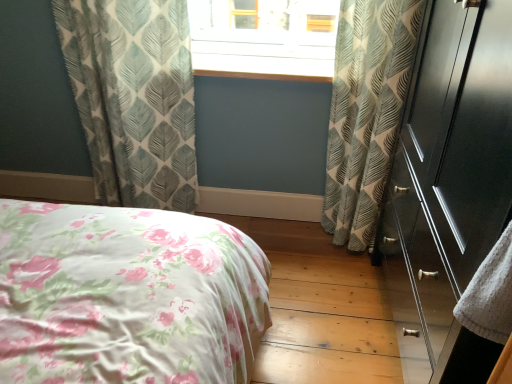
How much space does light blue textured curtains at upper left, acting as the 1th curtain starting from the left, occupy vertically?

The height of light blue textured curtains at upper left, acting as the 1th curtain starting from the left, is 3.42 feet.

Describe the element at coordinates (263, 61) in the screenshot. This screenshot has width=512, height=384. I see `wooden at center` at that location.

Identify the location of glossy dark wood dresser at right. (450, 184).

Considering the positions of points (366, 121) and (506, 43), is point (366, 121) closer to camera compared to point (506, 43)?

No.

Is leaf-patterned fabric curtain at right, the 2th curtain from the left, looking in the opposite direction of glossy dark wood dresser at right?

No.

Considering the sizes of objects leaf-patterned fabric curtain at right, positioned as the 1th curtain in right-to-left order, and glossy dark wood dresser at right in the image provided, who is thinner, leaf-patterned fabric curtain at right, positioned as the 1th curtain in right-to-left order, or glossy dark wood dresser at right?

leaf-patterned fabric curtain at right, positioned as the 1th curtain in right-to-left order.

Consider the image. How different are the orientations of light blue textured curtains at upper left, acting as the 1th curtain starting from the left, and wooden at center in degrees?

There is a 3.75-degree angle between the facing directions of light blue textured curtains at upper left, acting as the 1th curtain starting from the left, and wooden at center.

Which object is closer to the camera taking this photo, light blue textured curtains at upper left, marked as the second curtain in a right-to-left arrangement, or wooden at center?

light blue textured curtains at upper left, marked as the second curtain in a right-to-left arrangement, is in front.

Does light blue textured curtains at upper left, marked as the second curtain in a right-to-left arrangement, turn towards wooden at center?

No.

Can you tell me how much wooden at center and leaf-patterned fabric curtain at right, the 2th curtain from the left, differ in facing direction?

The angular difference between wooden at center and leaf-patterned fabric curtain at right, the 2th curtain from the left, is 3.75 degrees.

From a real-world perspective, is wooden at center under leaf-patterned fabric curtain at right, the 2th curtain from the left?

Actually, wooden at center is physically above leaf-patterned fabric curtain at right, the 2th curtain from the left, in the real world.

You are a GUI agent. You are given a task and a screenshot of the screen. Output one action in this format:
    pyautogui.click(x=<x>, y=<y>)
    Task: Click on the 2nd curtain in front of the wooden at center
    
    Given the screenshot: What is the action you would take?
    pyautogui.click(x=366, y=112)

Is wooden at center taller than leaf-patterned fabric curtain at right, positioned as the 1th curtain in right-to-left order?

In fact, wooden at center may be shorter than leaf-patterned fabric curtain at right, positioned as the 1th curtain in right-to-left order.

Does glossy dark wood dresser at right touch light blue textured curtains at upper left, marked as the second curtain in a right-to-left arrangement?

There is a gap between glossy dark wood dresser at right and light blue textured curtains at upper left, marked as the second curtain in a right-to-left arrangement.

Between glossy dark wood dresser at right and light blue textured curtains at upper left, acting as the 1th curtain starting from the left, which one has smaller size?

light blue textured curtains at upper left, acting as the 1th curtain starting from the left.

Based on the photo, can you confirm if glossy dark wood dresser at right is shorter than light blue textured curtains at upper left, marked as the second curtain in a right-to-left arrangement?

In fact, glossy dark wood dresser at right may be taller than light blue textured curtains at upper left, marked as the second curtain in a right-to-left arrangement.

From the picture: From a real-world perspective, is glossy dark wood dresser at right above or below light blue textured curtains at upper left, acting as the 1th curtain starting from the left?

glossy dark wood dresser at right is above light blue textured curtains at upper left, acting as the 1th curtain starting from the left.

Considering the positions of objects wooden at center and light blue textured curtains at upper left, marked as the second curtain in a right-to-left arrangement, in the image provided, who is in front, wooden at center or light blue textured curtains at upper left, marked as the second curtain in a right-to-left arrangement,?

Positioned in front is light blue textured curtains at upper left, marked as the second curtain in a right-to-left arrangement.

Is the surface of wooden at center in direct contact with light blue textured curtains at upper left, marked as the second curtain in a right-to-left arrangement?

No, wooden at center is not touching light blue textured curtains at upper left, marked as the second curtain in a right-to-left arrangement.

Which of these two, wooden at center or light blue textured curtains at upper left, marked as the second curtain in a right-to-left arrangement, stands shorter?

Standing shorter between the two is wooden at center.

Which of these two, wooden at center or light blue textured curtains at upper left, marked as the second curtain in a right-to-left arrangement, is smaller?

Smaller between the two is wooden at center.

From a real-world perspective, count 1st curtains downward from the glossy dark wood dresser at right and point to it. Please provide its 2D coordinates.

[(366, 112)]

In the scene shown: Is glossy dark wood dresser at right positioned far away from leaf-patterned fabric curtain at right, positioned as the 1th curtain in right-to-left order?

That's not correct — glossy dark wood dresser at right is a little close to leaf-patterned fabric curtain at right, positioned as the 1th curtain in right-to-left order.

Does glossy dark wood dresser at right have a lesser width compared to leaf-patterned fabric curtain at right, positioned as the 1th curtain in right-to-left order?

No.

From a real-world perspective, is glossy dark wood dresser at right under leaf-patterned fabric curtain at right, positioned as the 1th curtain in right-to-left order?

No, from a real-world perspective, glossy dark wood dresser at right is not below leaf-patterned fabric curtain at right, positioned as the 1th curtain in right-to-left order.

Is wooden at center in front of or behind glossy dark wood dresser at right in the image?

wooden at center is behind glossy dark wood dresser at right.

I want to click on dresser in front of the wooden at center, so tap(450, 184).

From the image's perspective, is wooden at center located above or below glossy dark wood dresser at right?

From the image's perspective, wooden at center appears above glossy dark wood dresser at right.

Which is more to the left, wooden at center or glossy dark wood dresser at right?

→ wooden at center.

At what (x,y) coordinates should I click in order to perform the action: click on curtain that is the 1st one below the glossy dark wood dresser at right (from a real-world perspective). Please return your answer as a coordinate pair (x, y). The width and height of the screenshot is (512, 384). Looking at the image, I should click on (366, 112).

Identify the location of curtain on the left of wooden at center. The width and height of the screenshot is (512, 384). (134, 98).

Which object lies further to the anchor point light blue textured curtains at upper left, marked as the second curtain in a right-to-left arrangement, glossy dark wood dresser at right or wooden at center?

glossy dark wood dresser at right is further to light blue textured curtains at upper left, marked as the second curtain in a right-to-left arrangement.

Estimate the real-world distances between objects in this image. Which object is further from leaf-patterned fabric curtain at right, the 2th curtain from the left, light blue textured curtains at upper left, marked as the second curtain in a right-to-left arrangement, or wooden at center?

light blue textured curtains at upper left, marked as the second curtain in a right-to-left arrangement, is further to leaf-patterned fabric curtain at right, the 2th curtain from the left.

Based on their spatial positions, is leaf-patterned fabric curtain at right, positioned as the 1th curtain in right-to-left order, or light blue textured curtains at upper left, acting as the 1th curtain starting from the left, further from glossy dark wood dresser at right?

light blue textured curtains at upper left, acting as the 1th curtain starting from the left, lies further to glossy dark wood dresser at right than the other object.

Considering their positions, is wooden at center positioned closer to light blue textured curtains at upper left, marked as the second curtain in a right-to-left arrangement, than glossy dark wood dresser at right?

wooden at center is closer to light blue textured curtains at upper left, marked as the second curtain in a right-to-left arrangement.

When comparing their distances from glossy dark wood dresser at right, does light blue textured curtains at upper left, marked as the second curtain in a right-to-left arrangement, or wooden at center seem closer?

wooden at center is positioned closer to the anchor glossy dark wood dresser at right.

Which object lies further to the anchor point wooden at center, glossy dark wood dresser at right or leaf-patterned fabric curtain at right, positioned as the 1th curtain in right-to-left order?

glossy dark wood dresser at right is positioned further to the anchor wooden at center.

From the image, which object appears to be nearer to light blue textured curtains at upper left, acting as the 1th curtain starting from the left, wooden at center or leaf-patterned fabric curtain at right, the 2th curtain from the left?

Among the two, wooden at center is located nearer to light blue textured curtains at upper left, acting as the 1th curtain starting from the left.

Considering their positions, is leaf-patterned fabric curtain at right, the 2th curtain from the left, positioned closer to light blue textured curtains at upper left, marked as the second curtain in a right-to-left arrangement, than wooden at center?

Based on the image, wooden at center appears to be nearer to light blue textured curtains at upper left, marked as the second curtain in a right-to-left arrangement.

You are a GUI agent. You are given a task and a screenshot of the screen. Output one action in this format:
    pyautogui.click(x=<x>, y=<y>)
    Task: Click on the curtain between light blue textured curtains at upper left, marked as the second curtain in a right-to-left arrangement, and glossy dark wood dresser at right from left to right
    This screenshot has height=384, width=512.
    Given the screenshot: What is the action you would take?
    pyautogui.click(x=366, y=112)

The height and width of the screenshot is (384, 512). I want to click on window sill between light blue textured curtains at upper left, marked as the second curtain in a right-to-left arrangement, and leaf-patterned fabric curtain at right, positioned as the 1th curtain in right-to-left order, so click(263, 61).